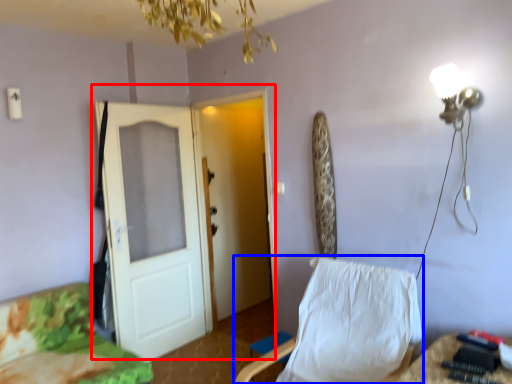
Question: Which of the following is the farthest to the observer, door (highlighted by a red box) or chair (highlighted by a blue box)?

Choices:
 (A) door
 (B) chair

Answer: (A)